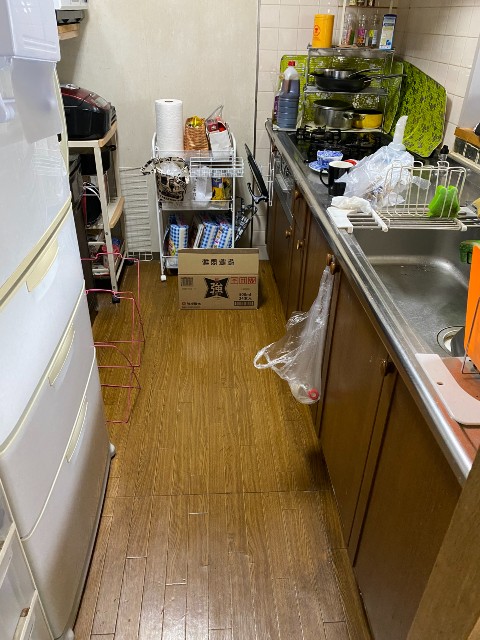
The image size is (480, 640). In order to click on storage shelf in this screenshot , I will do `click(105, 271)`, `click(108, 216)`, `click(93, 148)`, `click(214, 157)`, `click(207, 208)`, `click(168, 262)`, `click(322, 132)`, `click(330, 92)`.